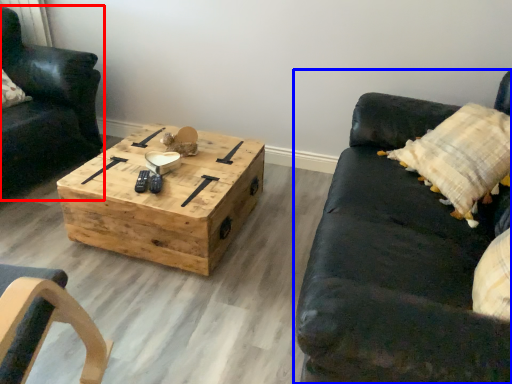
Question: Which object is further to the camera taking this photo, chair (highlighted by a red box) or studio couch (highlighted by a blue box)?

Choices:
 (A) chair
 (B) studio couch

Answer: (A)